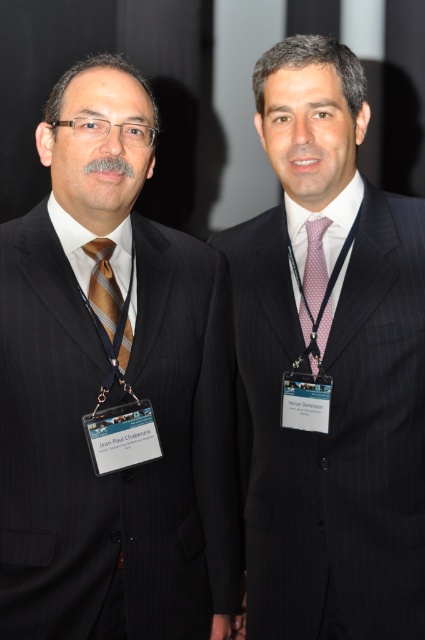
Question: Can you confirm if pinstriped suit at left is bigger than pink dotted fabric tie at center?

Choices:
 (A) no
 (B) yes

Answer: (B)

Question: Can you confirm if pinstriped suit at center is positioned above pink dotted fabric tie at center?

Choices:
 (A) yes
 (B) no

Answer: (B)

Question: Based on their relative distances, which object is nearer to the pinstriped suit at center?

Choices:
 (A) brown striped tie at center
 (B) pink dotted fabric tie at center
 (C) pinstriped suit at left

Answer: (B)

Question: Which object is positioned closest to the pinstriped suit at center?

Choices:
 (A) pinstriped suit at left
 (B) pink dotted fabric tie at center

Answer: (B)

Question: Can you confirm if pinstriped suit at left is positioned to the right of brown striped tie at center?

Choices:
 (A) yes
 (B) no

Answer: (A)

Question: Among these points, which one is nearest to the camera?

Choices:
 (A) (314, 156)
 (B) (328, 225)
 (C) (112, 292)

Answer: (C)